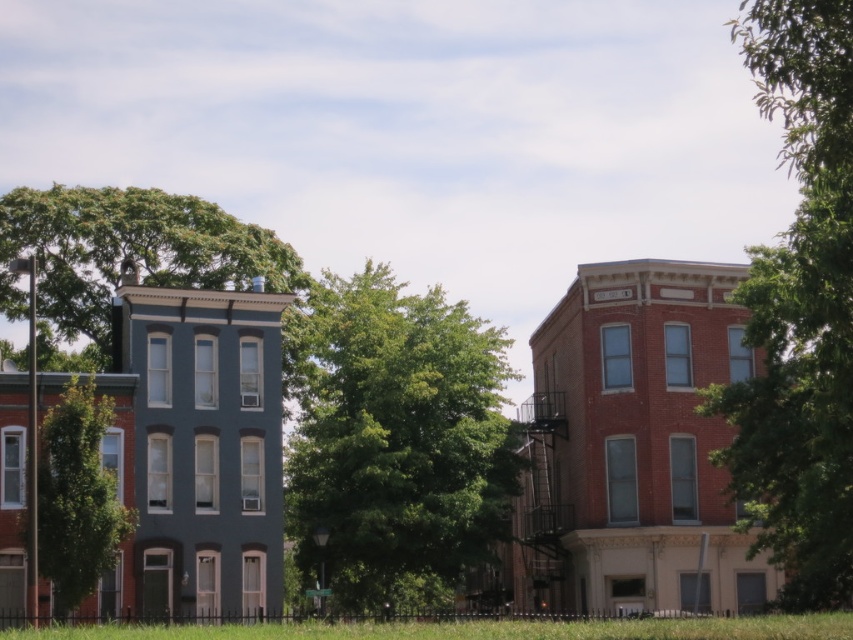
You are a gardener planning to plant a new tree in the urban scene. The green leafy tree at upper right and the green grass at lower center are already present. Based on their positions, which object is closer to you as you stand in the scene?

The green leafy tree at upper right is closer to you because it is in front of the green grass at lower center.

You are a landscape architect planning to add a new pathway between the two buildings. Considering the green leafy tree at upper left and the green grass at lower center, which one would require more consideration in terms of size when designing the pathway?

The green leafy tree at upper left requires more consideration due to its larger size compared to the green grass at lower center, so it may need more space around it to accommodate its size when designing the pathway.